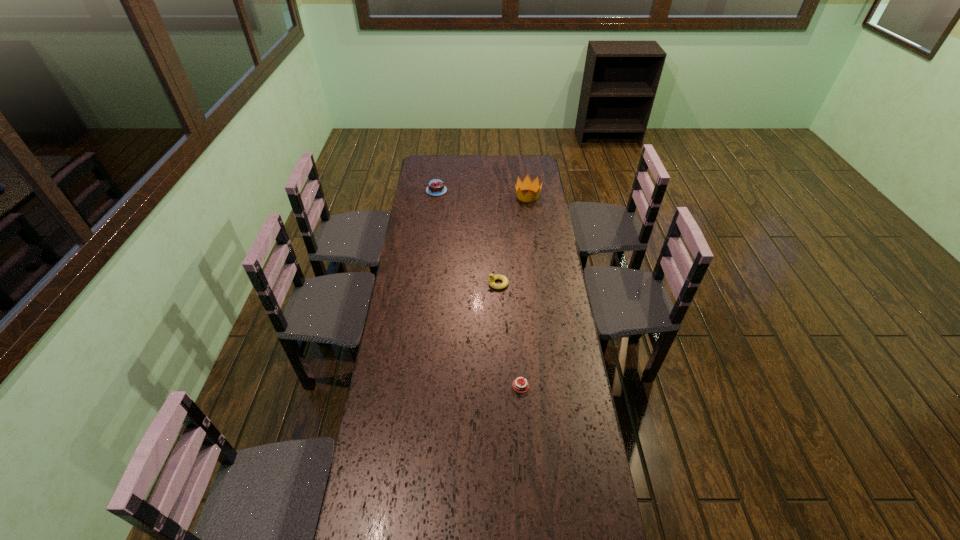
Where is `the tallest object`? This screenshot has height=540, width=960. the tallest object is located at coordinates (534, 186).

Where is `the left chocolate cake`? This screenshot has height=540, width=960. the left chocolate cake is located at coordinates (435, 187).

Where is `the leftmost object`? The image size is (960, 540). the leftmost object is located at coordinates (435, 187).

At what (x,y) coordinates should I click in order to perform the action: click on duckling. Please return your answer as a coordinate pair (x, y). This screenshot has height=540, width=960. Looking at the image, I should click on (492, 277).

The image size is (960, 540). What are the coordinates of `the right chocolate cake` in the screenshot? It's located at (518, 385).

This screenshot has height=540, width=960. Identify the location of the nearest object. (518, 385).

This screenshot has height=540, width=960. In order to click on blank space located on the back of the crown in this screenshot , I will do `click(524, 169)`.

Identify the location of vacant area situated on the right of the taller chocolate cake. This screenshot has height=540, width=960. [x=468, y=191].

Find the location of a particular element. The height and width of the screenshot is (540, 960). vacant space located 0.330m on the face of the duckling is located at coordinates (412, 284).

In order to click on blank area located on the face of the duckling in this screenshot , I will do `click(467, 284)`.